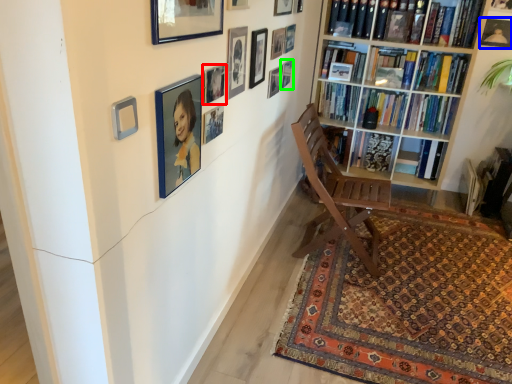
Question: Which object is positioned farthest from picture frame (highlighted by a red box)? Select from picture frame (highlighted by a blue box) and picture frame (highlighted by a green box).

Choices:
 (A) picture frame
 (B) picture frame

Answer: (A)